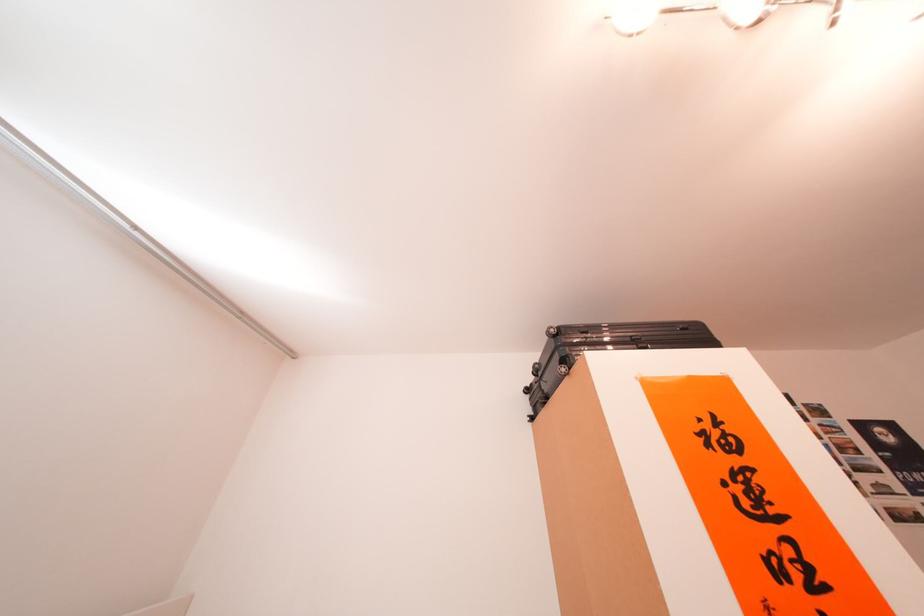
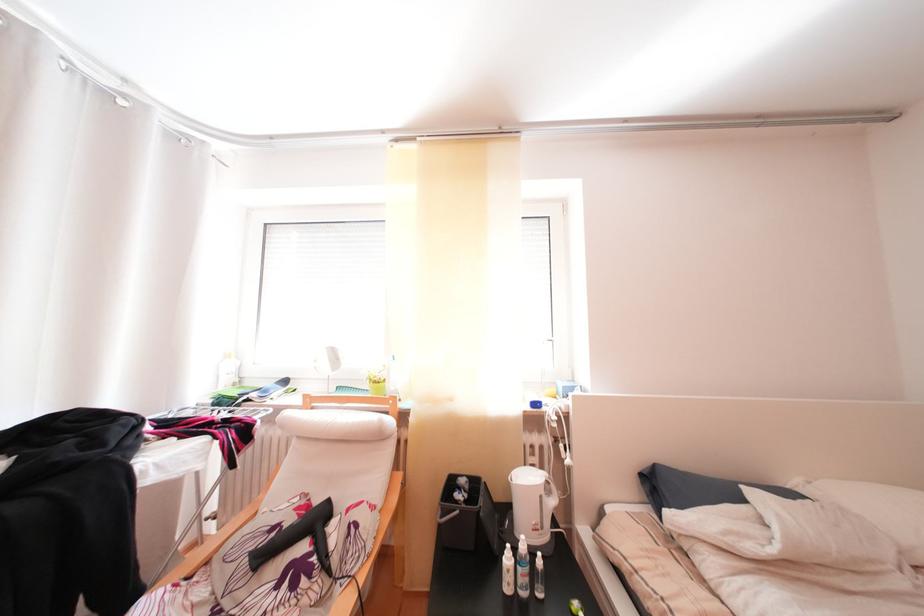
Question: The camera is either moving clockwise (left) or counter-clockwise (right) around the object. The first image is from the beginning of the video and the second image is from the end. Is the camera moving left or right when shooting the video?

Choices:
 (A) Left
 (B) Right

Answer: (B)